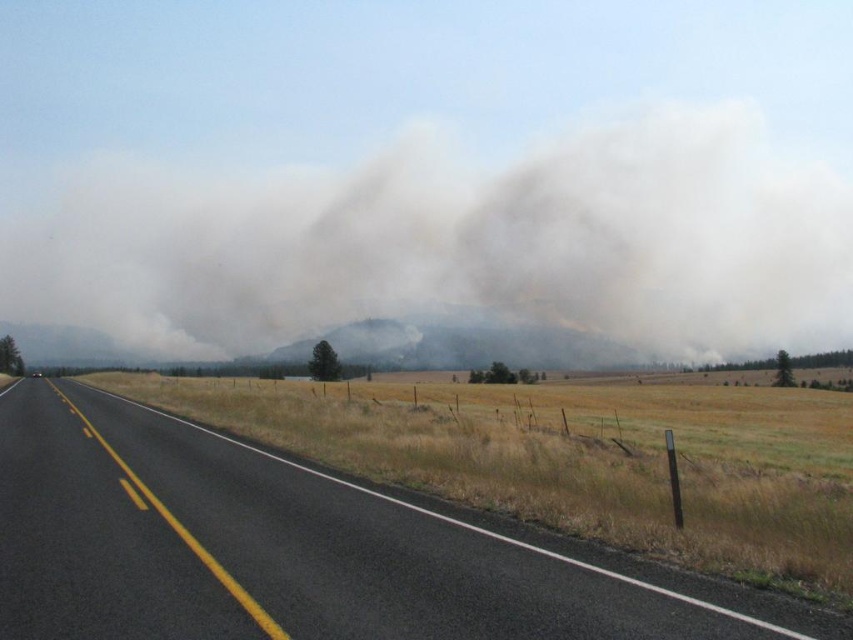
Question: Can you confirm if smoke/dense at center is positioned below black asphalt road at center?

Choices:
 (A) yes
 (B) no

Answer: (B)

Question: Which point is closer to the camera?

Choices:
 (A) (241, 484)
 (B) (3, 275)

Answer: (A)

Question: Does smoke/dense at center appear under black asphalt road at center?

Choices:
 (A) no
 (B) yes

Answer: (A)

Question: Is smoke/dense at center above black asphalt road at center?

Choices:
 (A) yes
 (B) no

Answer: (A)